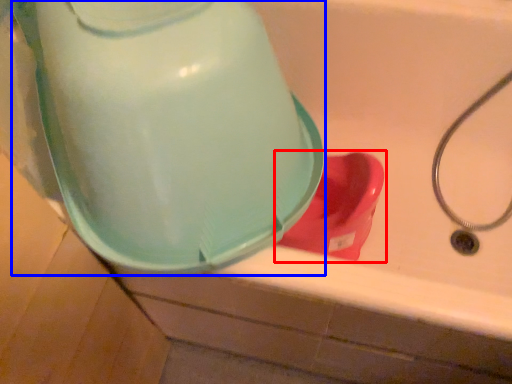
Question: Among these objects, which one is farthest to the camera, toilet (highlighted by a red box) or water cooler (highlighted by a blue box)?

Choices:
 (A) toilet
 (B) water cooler

Answer: (A)